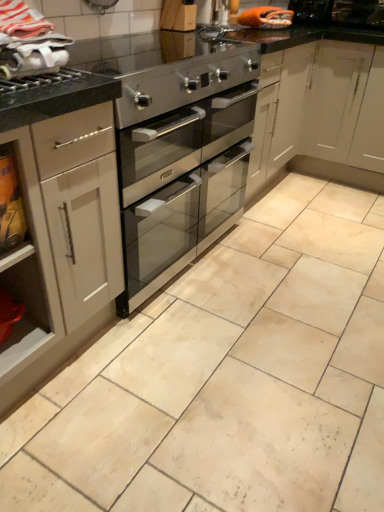
Question: Can you confirm if white fabric at upper left is taller than brushed metal gas stove at upper left?

Choices:
 (A) yes
 (B) no

Answer: (A)

Question: Can you confirm if white fabric at upper left is shorter than brushed metal gas stove at upper left?

Choices:
 (A) no
 (B) yes

Answer: (A)

Question: Is white fabric at upper left positioned in front of brushed metal gas stove at upper left?

Choices:
 (A) no
 (B) yes

Answer: (B)

Question: Can you confirm if white fabric at upper left is positioned to the right of brushed metal gas stove at upper left?

Choices:
 (A) no
 (B) yes

Answer: (B)

Question: Considering the relative sizes of white fabric at upper left and brushed metal gas stove at upper left in the image provided, is white fabric at upper left smaller than brushed metal gas stove at upper left?

Choices:
 (A) no
 (B) yes

Answer: (A)

Question: Is point (145, 64) positioned closer to the camera than point (8, 79)?

Choices:
 (A) closer
 (B) farther

Answer: (B)

Question: Relative to brushed metal gas stove at upper left, is stainless steel oven at upper left in front or behind?

Choices:
 (A) front
 (B) behind

Answer: (B)

Question: Considering the positions of stainless steel oven at upper left and brushed metal gas stove at upper left in the image, is stainless steel oven at upper left wider or thinner than brushed metal gas stove at upper left?

Choices:
 (A) thin
 (B) wide

Answer: (B)

Question: From a real-world perspective, is stainless steel oven at upper left physically located above or below brushed metal gas stove at upper left?

Choices:
 (A) above
 (B) below

Answer: (B)

Question: In terms of width, does white fabric at upper left look wider or thinner when compared to stainless steel oven at upper left?

Choices:
 (A) wide
 (B) thin

Answer: (B)

Question: Considering the positions of point (24, 5) and point (92, 44), is point (24, 5) closer or farther from the camera than point (92, 44)?

Choices:
 (A) farther
 (B) closer

Answer: (B)

Question: In terms of size, does white fabric at upper left appear bigger or smaller than stainless steel oven at upper left?

Choices:
 (A) small
 (B) big

Answer: (A)

Question: Based on their positions, is white fabric at upper left located to the left or right of stainless steel oven at upper left?

Choices:
 (A) right
 (B) left

Answer: (B)

Question: Does point (81, 361) appear closer or farther from the camera than point (33, 80)?

Choices:
 (A) farther
 (B) closer

Answer: (A)

Question: From a real-world perspective, is satin silver oven at center positioned above or below brushed metal gas stove at upper left?

Choices:
 (A) below
 (B) above

Answer: (A)